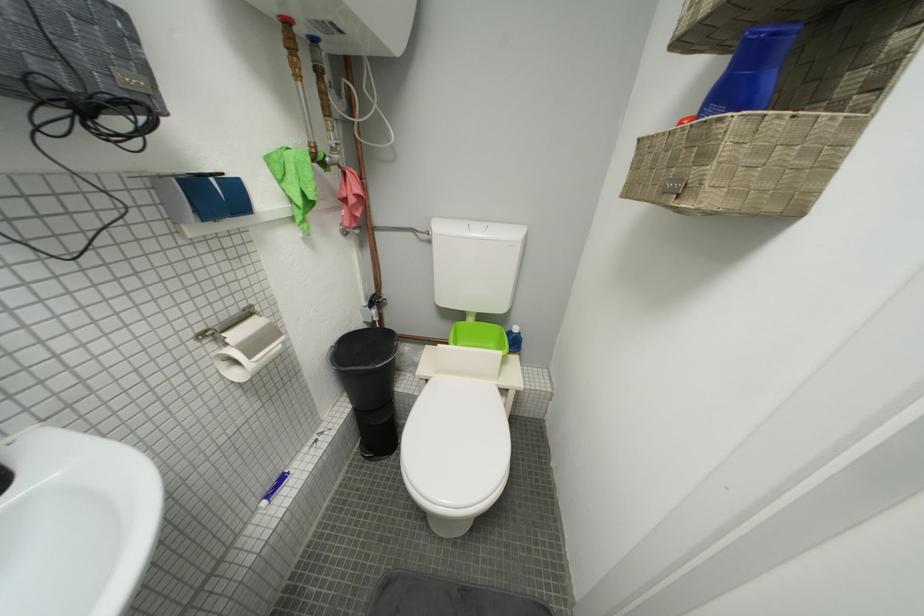
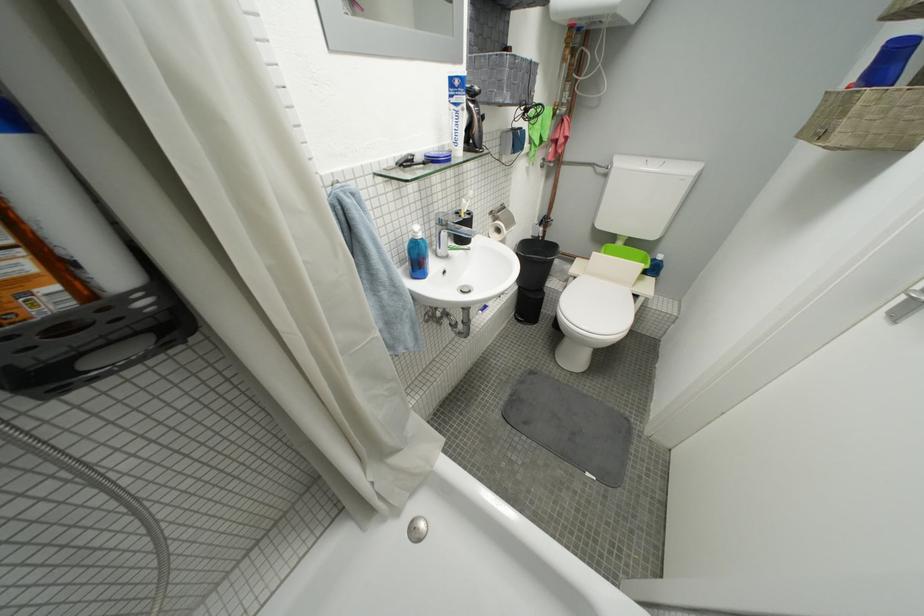
The point at (209,337) is marked in the first image. Where is the corresponding point in the second image?

(500, 214)